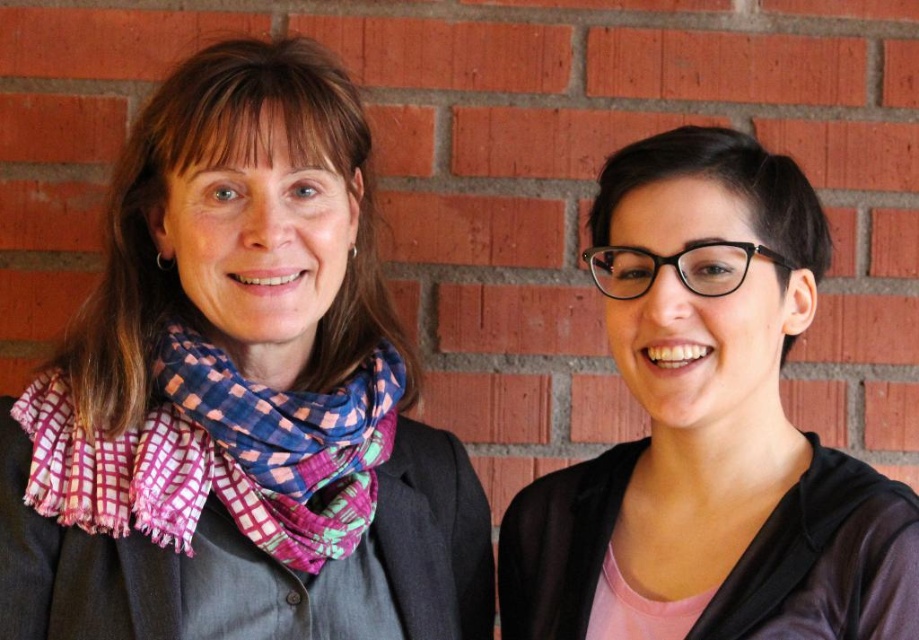
Who is shorter, multicolored scarf at left or multicolored woven scarf at left?

multicolored woven scarf at left is shorter.

Can you confirm if multicolored scarf at left is shorter than multicolored woven scarf at left?

Incorrect, multicolored scarf at left's height does not fall short of multicolored woven scarf at left's.

Is point (315, 52) closer to viewer compared to point (82, 461)?

That is False.

This screenshot has height=640, width=919. I want to click on multicolored scarf at left, so click(x=237, y=396).

Can you confirm if multicolored scarf at left is wider than pink matte scarf at upper right?

Yes.

Looking at this image, does multicolored scarf at left have a smaller size compared to pink matte scarf at upper right?

No, multicolored scarf at left is not smaller than pink matte scarf at upper right.

Does point (132, 317) lie behind point (709, 291)?

Yes, it is behind point (709, 291).

Where is `multicolored scarf at left`? This screenshot has height=640, width=919. multicolored scarf at left is located at coordinates (237, 396).

Can you confirm if pink matte scarf at upper right is bigger than multicolored woven scarf at left?

Yes, pink matte scarf at upper right is bigger than multicolored woven scarf at left.

Does point (647, 609) come closer to viewer compared to point (290, 513)?

Yes, point (647, 609) is in front of point (290, 513).

The height and width of the screenshot is (640, 919). What are the coordinates of `pink matte scarf at upper right` in the screenshot? It's located at (708, 429).